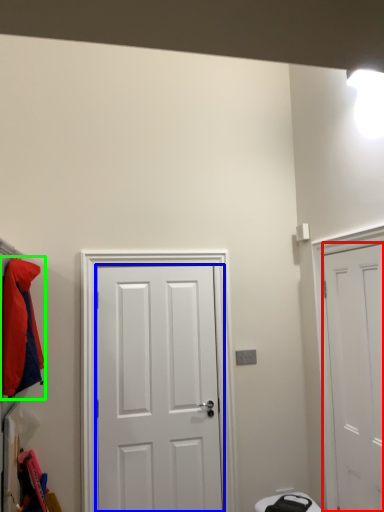
Question: Which is nearer to the door (highlighted by a red box)? door (highlighted by a blue box) or jacket (highlighted by a green box).

Choices:
 (A) door
 (B) jacket

Answer: (A)